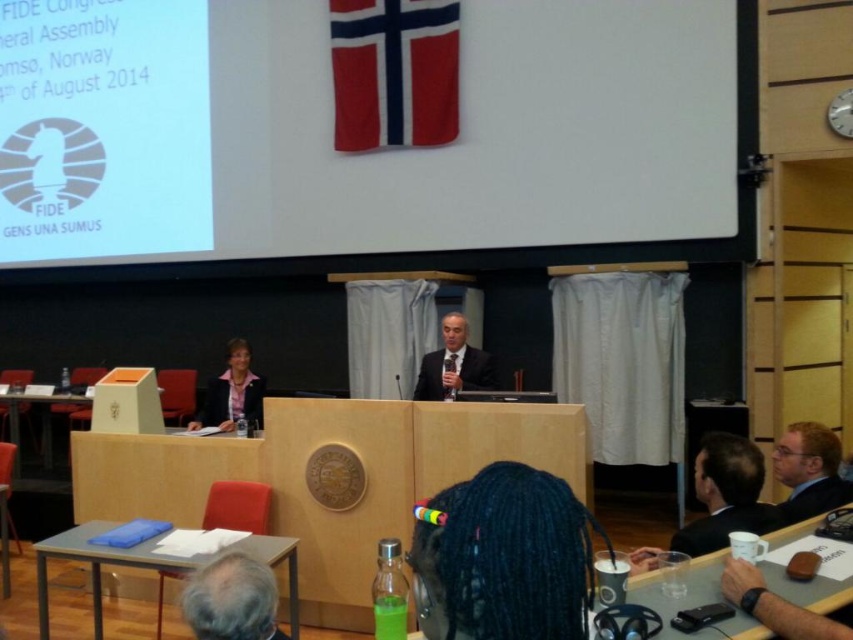
Question: Which of the following is the closest to the observer?

Choices:
 (A) (700, 227)
 (B) (793, 528)
 (C) (32, 8)
 (D) (454, 493)

Answer: (D)

Question: Does white paper at upper left appear under matte pink blazer at center?

Choices:
 (A) yes
 (B) no

Answer: (B)

Question: Does clear plastic table at lower right have a greater width compared to blue paper at lower left?

Choices:
 (A) yes
 (B) no

Answer: (B)

Question: Among these points, which one is nearest to the camera?

Choices:
 (A) (103, 168)
 (B) (741, 636)
 (C) (201, 406)
 (D) (277, 548)

Answer: (B)

Question: Which point appears farthest from the camera in this image?

Choices:
 (A) (425, 362)
 (B) (138, 141)

Answer: (B)

Question: Does clear plastic table at lower right appear on the right side of matte pink blazer at center?

Choices:
 (A) no
 (B) yes

Answer: (B)